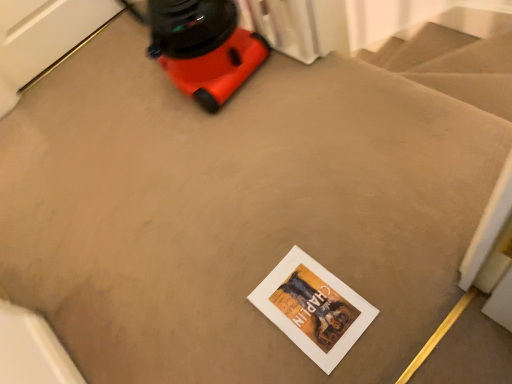
This screenshot has width=512, height=384. I want to click on orange plastic vacuum cleaner at upper left, so click(204, 48).

What do you see at coordinates (204, 48) in the screenshot?
I see `orange plastic vacuum cleaner at upper left` at bounding box center [204, 48].

What do you see at coordinates (313, 308) in the screenshot?
I see `white matte postcard at center` at bounding box center [313, 308].

Image resolution: width=512 pixels, height=384 pixels. I want to click on white matte postcard at center, so click(x=313, y=308).

Where is `orange plastic vacuum cleaner at upper left`? This screenshot has height=384, width=512. orange plastic vacuum cleaner at upper left is located at coordinates (204, 48).

Is white matte postcard at center to the left of orange plastic vacuum cleaner at upper left from the viewer's perspective?

Incorrect, white matte postcard at center is not on the left side of orange plastic vacuum cleaner at upper left.

Which is behind, white matte postcard at center or orange plastic vacuum cleaner at upper left?

orange plastic vacuum cleaner at upper left is further from the camera.

Between point (339, 283) and point (181, 51), which one is positioned in front?

Point (339, 283)

From the image's perspective, between white matte postcard at center and orange plastic vacuum cleaner at upper left, who is located below?

white matte postcard at center appears lower in the image.

From a real-world perspective, who is located higher, white matte postcard at center or orange plastic vacuum cleaner at upper left?

From a 3D spatial view, orange plastic vacuum cleaner at upper left is above.

Considering the sizes of objects white matte postcard at center and orange plastic vacuum cleaner at upper left in the image provided, who is thinner, white matte postcard at center or orange plastic vacuum cleaner at upper left?

white matte postcard at center.

In terms of height, does white matte postcard at center look taller or shorter compared to orange plastic vacuum cleaner at upper left?

In the image, white matte postcard at center appears to be shorter than orange plastic vacuum cleaner at upper left.

Can you confirm if white matte postcard at center is smaller than orange plastic vacuum cleaner at upper left?

Indeed, white matte postcard at center has a smaller size compared to orange plastic vacuum cleaner at upper left.

Is orange plastic vacuum cleaner at upper left a part of white matte postcard at center?

No, white matte postcard at center does not contain orange plastic vacuum cleaner at upper left.

Does white matte postcard at center touch orange plastic vacuum cleaner at upper left?

No, white matte postcard at center is not touching orange plastic vacuum cleaner at upper left.

Is white matte postcard at center oriented towards orange plastic vacuum cleaner at upper left?

No, white matte postcard at center is not aimed at orange plastic vacuum cleaner at upper left.

Where is `equipment to the left of white matte postcard at center`? This screenshot has height=384, width=512. equipment to the left of white matte postcard at center is located at coordinates (204, 48).

Which object is positioned more to the right, orange plastic vacuum cleaner at upper left or white matte postcard at center?

white matte postcard at center.

Is orange plastic vacuum cleaner at upper left in front of or behind white matte postcard at center in the image?

orange plastic vacuum cleaner at upper left is positioned farther from the viewer than white matte postcard at center.

Is point (210, 21) in front of point (315, 264)?

No, it is behind (315, 264).

From the image's perspective, which is below, orange plastic vacuum cleaner at upper left or white matte postcard at center?

white matte postcard at center, from the image's perspective.

From a real-world perspective, is orange plastic vacuum cleaner at upper left positioned above or below white matte postcard at center?

Clearly, from a real-world perspective, orange plastic vacuum cleaner at upper left is above white matte postcard at center.

Considering the sizes of objects orange plastic vacuum cleaner at upper left and white matte postcard at center in the image provided, who is thinner, orange plastic vacuum cleaner at upper left or white matte postcard at center?

With smaller width is white matte postcard at center.

In terms of height, does orange plastic vacuum cleaner at upper left look taller or shorter compared to white matte postcard at center?

Considering their sizes, orange plastic vacuum cleaner at upper left has more height than white matte postcard at center.

Is orange plastic vacuum cleaner at upper left bigger or smaller than white matte postcard at center?

Answer: orange plastic vacuum cleaner at upper left is bigger than white matte postcard at center.

Would you say orange plastic vacuum cleaner at upper left is outside white matte postcard at center?

Yes, orange plastic vacuum cleaner at upper left is outside of white matte postcard at center.

Is orange plastic vacuum cleaner at upper left far from white matte postcard at center?

orange plastic vacuum cleaner at upper left is actually quite close to white matte postcard at center.

Could you tell me if orange plastic vacuum cleaner at upper left is turned towards white matte postcard at center?

No, orange plastic vacuum cleaner at upper left is not oriented towards white matte postcard at center.

Looking at this image, how distant is orange plastic vacuum cleaner at upper left from white matte postcard at center?

orange plastic vacuum cleaner at upper left and white matte postcard at center are 33.39 inches apart.

Find the location of a particular element. postcard located in front of the orange plastic vacuum cleaner at upper left is located at coordinates (313, 308).

Where is `equipment that appears behind the white matte postcard at center`? The image size is (512, 384). equipment that appears behind the white matte postcard at center is located at coordinates (204, 48).

Where is `postcard below the orange plastic vacuum cleaner at upper left (from a real-world perspective)`? The width and height of the screenshot is (512, 384). postcard below the orange plastic vacuum cleaner at upper left (from a real-world perspective) is located at coordinates (313, 308).